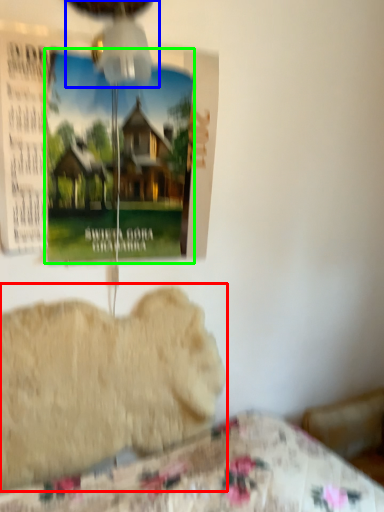
Question: Which object is the farthest from animal (highlighted by a red box)? Choose among these: mechanical fan (highlighted by a blue box) or poster page (highlighted by a green box).

Choices:
 (A) mechanical fan
 (B) poster page

Answer: (A)